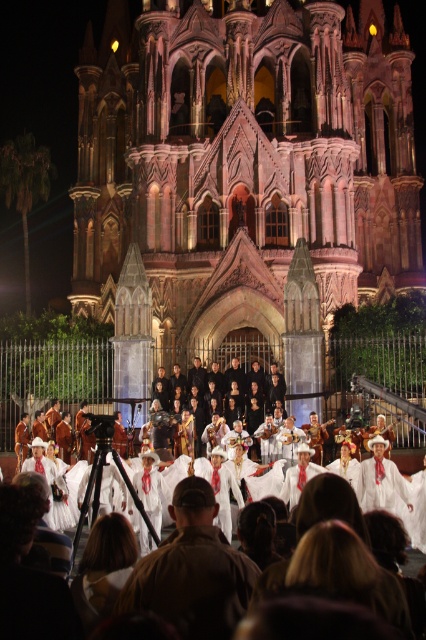
Does pink stone church at center have a larger size compared to white cotton dress at center?

Yes.

Locate an element on the screen. Image resolution: width=426 pixels, height=640 pixels. pink stone church at center is located at coordinates (244, 168).